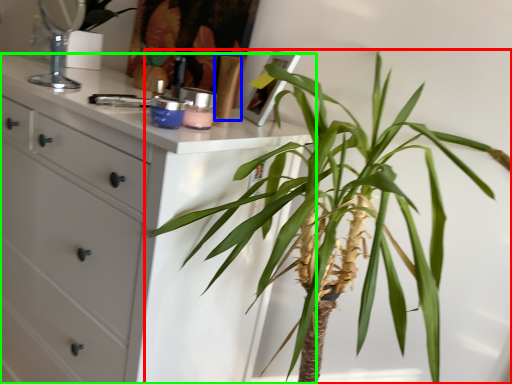
Question: Based on their relative distances, which object is nearer to houseplant (highlighted by a red box)? Choose from toiletry (highlighted by a blue box) and chest of drawers (highlighted by a green box).

Choices:
 (A) toiletry
 (B) chest of drawers

Answer: (B)